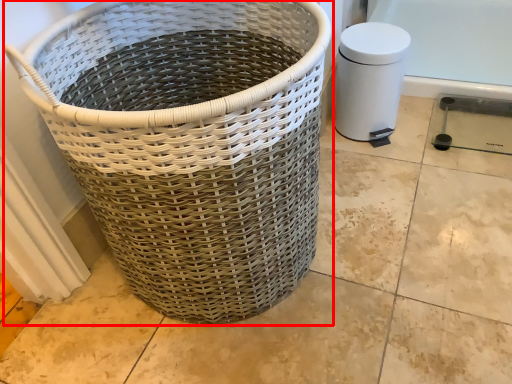
Question: From the image's perspective, what is the correct spatial positioning of waste container (annotated by the red box) in reference to water heater?

Choices:
 (A) above
 (B) below

Answer: (B)